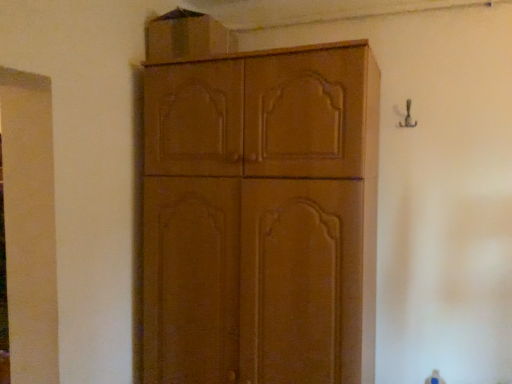
Measure the distance between matte brown cabinet at upper center, acting as the second cabinetry starting from the bottom, and camera.

matte brown cabinet at upper center, acting as the second cabinetry starting from the bottom, and camera are 5.56 feet apart from each other.

Image resolution: width=512 pixels, height=384 pixels. What do you see at coordinates (186, 37) in the screenshot?
I see `matte brown cabinet at upper center, acting as the second cabinetry starting from the bottom` at bounding box center [186, 37].

I want to click on matte brown cabinet at upper center, which is counted as the first cabinetry, starting from the top, so point(186,37).

What do you see at coordinates (258, 214) in the screenshot? The width and height of the screenshot is (512, 384). I see `matte wood cabinet at center, positioned as the 1th cabinetry in bottom-to-top order` at bounding box center [258, 214].

Image resolution: width=512 pixels, height=384 pixels. I want to click on matte wood cabinet at center, positioned as the 1th cabinetry in bottom-to-top order, so click(258, 214).

Find the location of a particular element. This screenshot has width=512, height=384. matte brown cabinet at upper center, which is counted as the first cabinetry, starting from the top is located at coordinates (186, 37).

Which object is positioned more to the right, matte wood cabinet at center, positioned as the 1th cabinetry in bottom-to-top order, or matte brown cabinet at upper center, acting as the second cabinetry starting from the bottom?

matte wood cabinet at center, positioned as the 1th cabinetry in bottom-to-top order, is more to the right.

Considering the relative positions of matte wood cabinet at center, the second cabinetry in the top-to-bottom sequence, and matte brown cabinet at upper center, acting as the second cabinetry starting from the bottom, in the image provided, is matte wood cabinet at center, the second cabinetry in the top-to-bottom sequence, in front of matte brown cabinet at upper center, acting as the second cabinetry starting from the bottom,?

Yes, it is.

Which is in front, point (284, 340) or point (207, 47)?

The point (284, 340) is more forward.

From the image's perspective, is matte wood cabinet at center, positioned as the 1th cabinetry in bottom-to-top order, positioned above or below matte brown cabinet at upper center, which is counted as the first cabinetry, starting from the top?

Based on their image positions, matte wood cabinet at center, positioned as the 1th cabinetry in bottom-to-top order, is located beneath matte brown cabinet at upper center, which is counted as the first cabinetry, starting from the top.

From a real-world perspective, between matte wood cabinet at center, the second cabinetry in the top-to-bottom sequence, and matte brown cabinet at upper center, which is counted as the first cabinetry, starting from the top, who is vertically higher?

matte brown cabinet at upper center, which is counted as the first cabinetry, starting from the top, is physically above.

Which object is thinner, matte wood cabinet at center, positioned as the 1th cabinetry in bottom-to-top order, or matte brown cabinet at upper center, which is counted as the first cabinetry, starting from the top?

matte brown cabinet at upper center, which is counted as the first cabinetry, starting from the top.

In terms of height, does matte wood cabinet at center, positioned as the 1th cabinetry in bottom-to-top order, look taller or shorter compared to matte brown cabinet at upper center, which is counted as the first cabinetry, starting from the top?

Considering their sizes, matte wood cabinet at center, positioned as the 1th cabinetry in bottom-to-top order, has more height than matte brown cabinet at upper center, which is counted as the first cabinetry, starting from the top.

Who is bigger, matte wood cabinet at center, the second cabinetry in the top-to-bottom sequence, or matte brown cabinet at upper center, which is counted as the first cabinetry, starting from the top?

With larger size is matte wood cabinet at center, the second cabinetry in the top-to-bottom sequence.

In the scene shown: Is matte wood cabinet at center, positioned as the 1th cabinetry in bottom-to-top order, not inside matte brown cabinet at upper center, acting as the second cabinetry starting from the bottom?

Yes, matte wood cabinet at center, positioned as the 1th cabinetry in bottom-to-top order, is not within matte brown cabinet at upper center, acting as the second cabinetry starting from the bottom.

Would you say matte wood cabinet at center, positioned as the 1th cabinetry in bottom-to-top order, is a long distance from matte brown cabinet at upper center, which is counted as the first cabinetry, starting from the top?

No.

Could you tell me if matte wood cabinet at center, positioned as the 1th cabinetry in bottom-to-top order, is turned towards matte brown cabinet at upper center, which is counted as the first cabinetry, starting from the top?

No, matte wood cabinet at center, positioned as the 1th cabinetry in bottom-to-top order, is not facing towards matte brown cabinet at upper center, which is counted as the first cabinetry, starting from the top.

Can you tell me how much matte wood cabinet at center, positioned as the 1th cabinetry in bottom-to-top order, and matte brown cabinet at upper center, acting as the second cabinetry starting from the bottom, differ in facing direction?

0.351 degrees.

The width and height of the screenshot is (512, 384). There is a matte wood cabinet at center, the second cabinetry in the top-to-bottom sequence. Find the location of `cabinetry above it (from a real-world perspective)`. cabinetry above it (from a real-world perspective) is located at coordinates (186, 37).

Is matte brown cabinet at upper center, acting as the second cabinetry starting from the bottom, to the left or to the right of matte wood cabinet at center, positioned as the 1th cabinetry in bottom-to-top order, in the image?

From the image, it's evident that matte brown cabinet at upper center, acting as the second cabinetry starting from the bottom, is to the left of matte wood cabinet at center, positioned as the 1th cabinetry in bottom-to-top order.

Relative to matte wood cabinet at center, the second cabinetry in the top-to-bottom sequence, is matte brown cabinet at upper center, which is counted as the first cabinetry, starting from the top, in front or behind?

Clearly, matte brown cabinet at upper center, which is counted as the first cabinetry, starting from the top, is behind matte wood cabinet at center, the second cabinetry in the top-to-bottom sequence.

Considering the positions of points (213, 46) and (357, 110), is point (213, 46) farther from camera compared to point (357, 110)?

Yes, point (213, 46) is behind point (357, 110).

From the image's perspective, is matte brown cabinet at upper center, acting as the second cabinetry starting from the bottom, over matte wood cabinet at center, positioned as the 1th cabinetry in bottom-to-top order?

Indeed, from the image's perspective, matte brown cabinet at upper center, acting as the second cabinetry starting from the bottom, is shown above matte wood cabinet at center, positioned as the 1th cabinetry in bottom-to-top order.

From a real-world perspective, is matte brown cabinet at upper center, which is counted as the first cabinetry, starting from the top, over matte wood cabinet at center, positioned as the 1th cabinetry in bottom-to-top order?

Correct, in the physical world, matte brown cabinet at upper center, which is counted as the first cabinetry, starting from the top, is higher than matte wood cabinet at center, positioned as the 1th cabinetry in bottom-to-top order.

Which of these two, matte brown cabinet at upper center, acting as the second cabinetry starting from the bottom, or matte wood cabinet at center, positioned as the 1th cabinetry in bottom-to-top order, is thinner?

Thinner between the two is matte brown cabinet at upper center, acting as the second cabinetry starting from the bottom.

Considering the sizes of objects matte brown cabinet at upper center, which is counted as the first cabinetry, starting from the top, and matte wood cabinet at center, positioned as the 1th cabinetry in bottom-to-top order, in the image provided, who is taller, matte brown cabinet at upper center, which is counted as the first cabinetry, starting from the top, or matte wood cabinet at center, positioned as the 1th cabinetry in bottom-to-top order,?

With more height is matte wood cabinet at center, positioned as the 1th cabinetry in bottom-to-top order.

Does matte brown cabinet at upper center, acting as the second cabinetry starting from the bottom, have a smaller size compared to matte wood cabinet at center, positioned as the 1th cabinetry in bottom-to-top order?

Yes.

Is matte brown cabinet at upper center, which is counted as the first cabinetry, starting from the top, completely or partially outside of matte wood cabinet at center, the second cabinetry in the top-to-bottom sequence?

That's correct, matte brown cabinet at upper center, which is counted as the first cabinetry, starting from the top, is outside of matte wood cabinet at center, the second cabinetry in the top-to-bottom sequence.

Is matte brown cabinet at upper center, which is counted as the first cabinetry, starting from the top, touching matte wood cabinet at center, the second cabinetry in the top-to-bottom sequence?

matte brown cabinet at upper center, which is counted as the first cabinetry, starting from the top, and matte wood cabinet at center, the second cabinetry in the top-to-bottom sequence, are not in contact.

Is matte brown cabinet at upper center, acting as the second cabinetry starting from the bottom, positioned with its back to matte wood cabinet at center, the second cabinetry in the top-to-bottom sequence?

That's not correct — matte brown cabinet at upper center, acting as the second cabinetry starting from the bottom, is not looking away from matte wood cabinet at center, the second cabinetry in the top-to-bottom sequence.

Can you tell me how much matte brown cabinet at upper center, acting as the second cabinetry starting from the bottom, and matte wood cabinet at center, positioned as the 1th cabinetry in bottom-to-top order, differ in facing direction?

The angle between the facing direction of matte brown cabinet at upper center, acting as the second cabinetry starting from the bottom, and the facing direction of matte wood cabinet at center, positioned as the 1th cabinetry in bottom-to-top order, is 0.351 degrees.

Image resolution: width=512 pixels, height=384 pixels. What are the coordinates of `cabinetry directly beneath the matte brown cabinet at upper center, acting as the second cabinetry starting from the bottom (from a real-world perspective)` in the screenshot? It's located at (258, 214).

This screenshot has height=384, width=512. What are the coordinates of `cabinetry below the matte brown cabinet at upper center, which is counted as the first cabinetry, starting from the top (from a real-world perspective)` in the screenshot? It's located at (258, 214).

Identify the location of cabinetry behind the matte wood cabinet at center, positioned as the 1th cabinetry in bottom-to-top order. (186, 37).